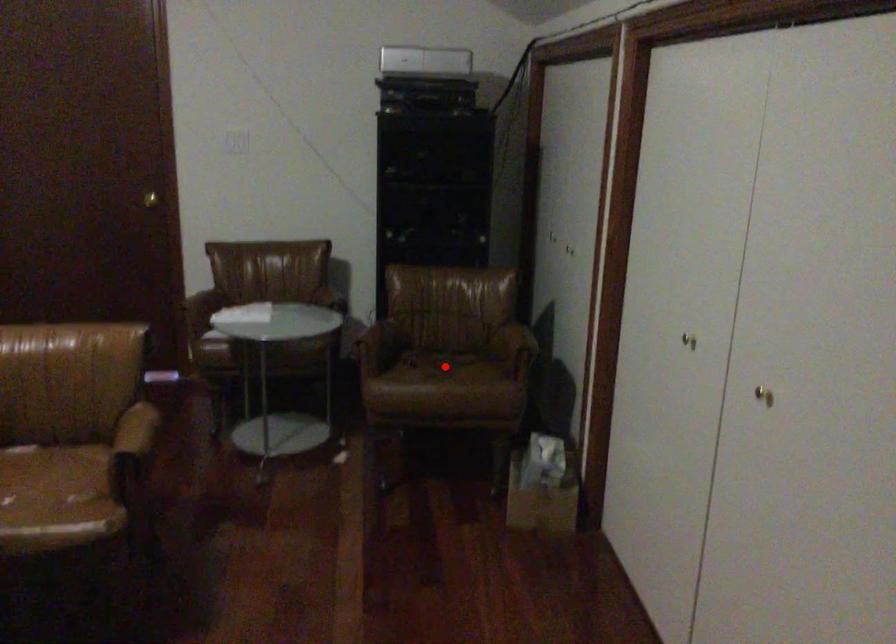
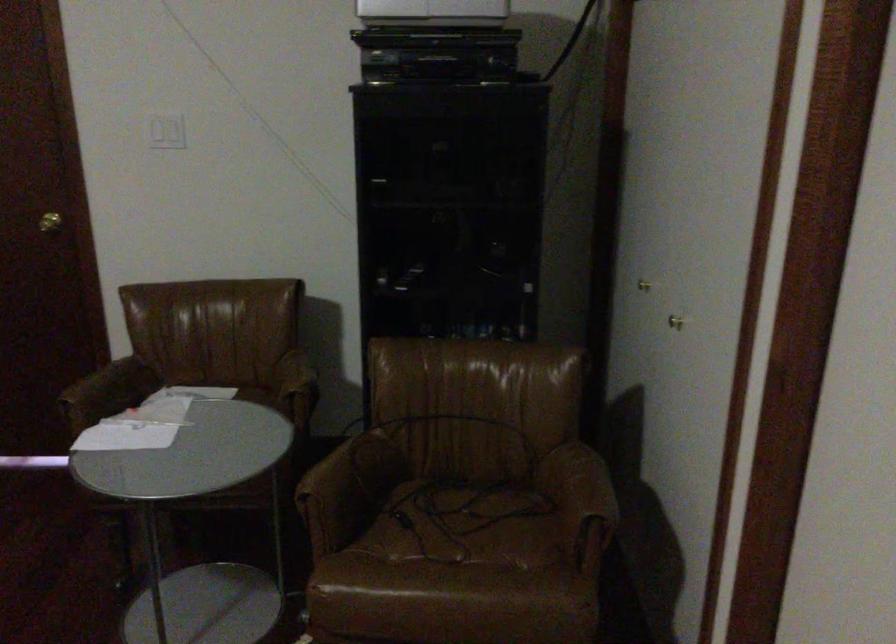
Question: I am providing you with two images of the same scene from different viewpoints. Given a red point in image1, look at the same physical point in image2. Is it:

Choices:
 (A) Closer to the viewpoint
 (B) Farther from the viewpoint

Answer: (A)